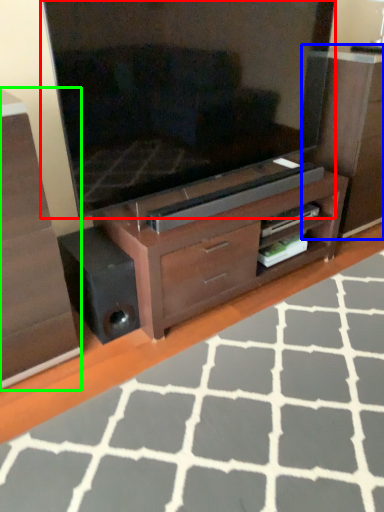
Question: Which is farther away from television (highlighted by a red box)? dresser (highlighted by a blue box) or chest of drawers (highlighted by a green box)?

Choices:
 (A) dresser
 (B) chest of drawers

Answer: (B)